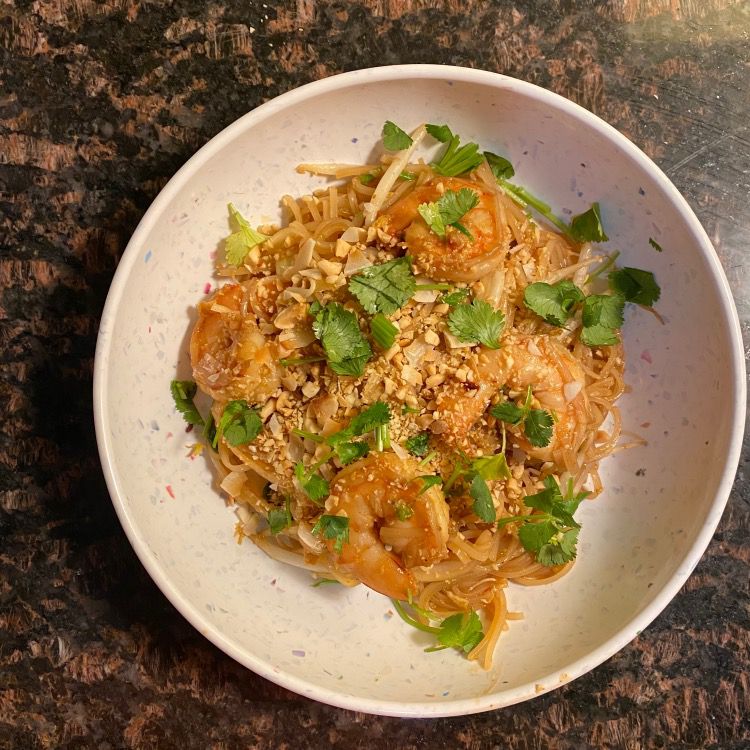
Identify the location of granite tabletop lower left. (106, 664).